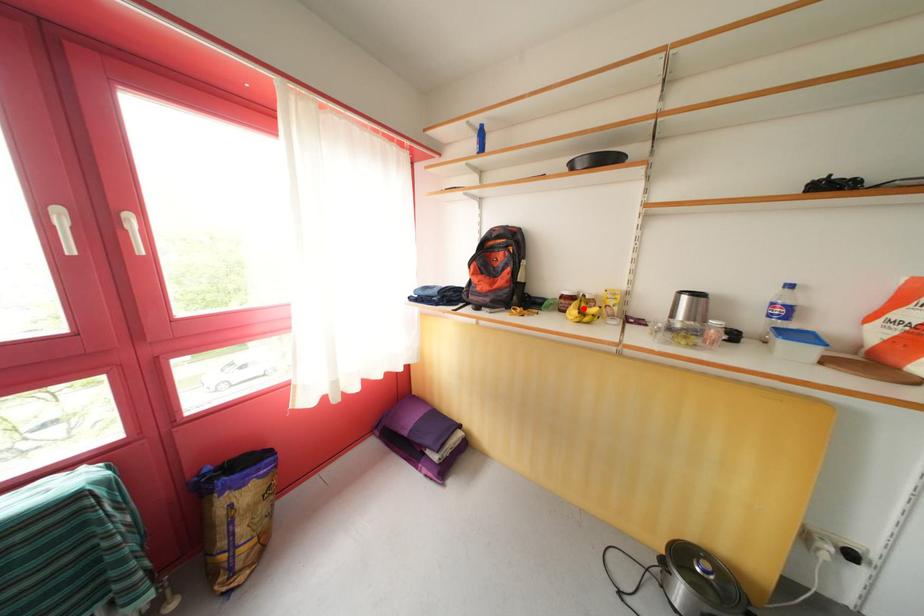
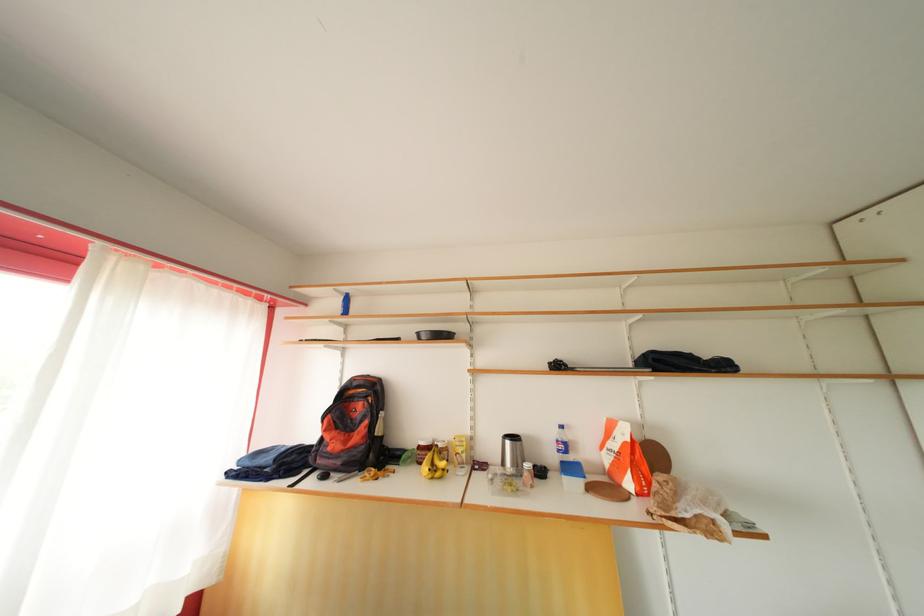
Question: A red point is marked in image1. In image2, is the corresponding 3D point closer to the camera or farther? Reply with the corresponding letter.

Choices:
 (A) The corresponding 3D point is closer.
 (B) The corresponding 3D point is farther.

Answer: (B)